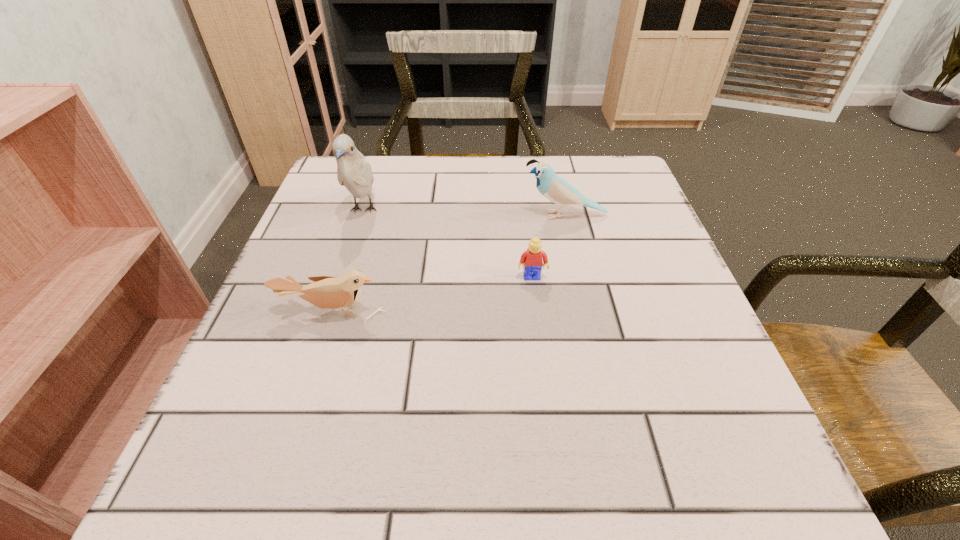
At what (x,y) coordinates should I click in order to perform the action: click on vacant space that satisfies the following two spatial constraints: 1. at the face of the rightmost bird; 2. at the beak of the nearest object. Please return your answer as a coordinate pair (x, y). The width and height of the screenshot is (960, 540). Looking at the image, I should click on (587, 312).